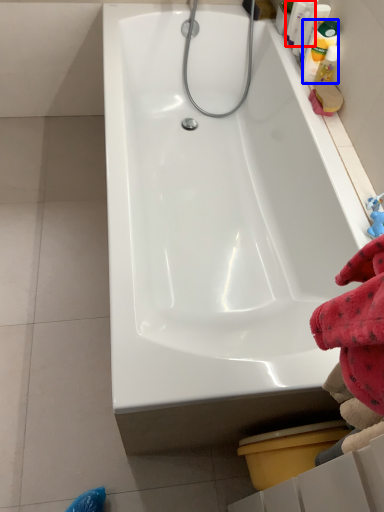
Question: Which object appears closest to the camera in this image, cleaning product (highlighted by a red box) or cleaning product (highlighted by a blue box)?

Choices:
 (A) cleaning product
 (B) cleaning product

Answer: (B)